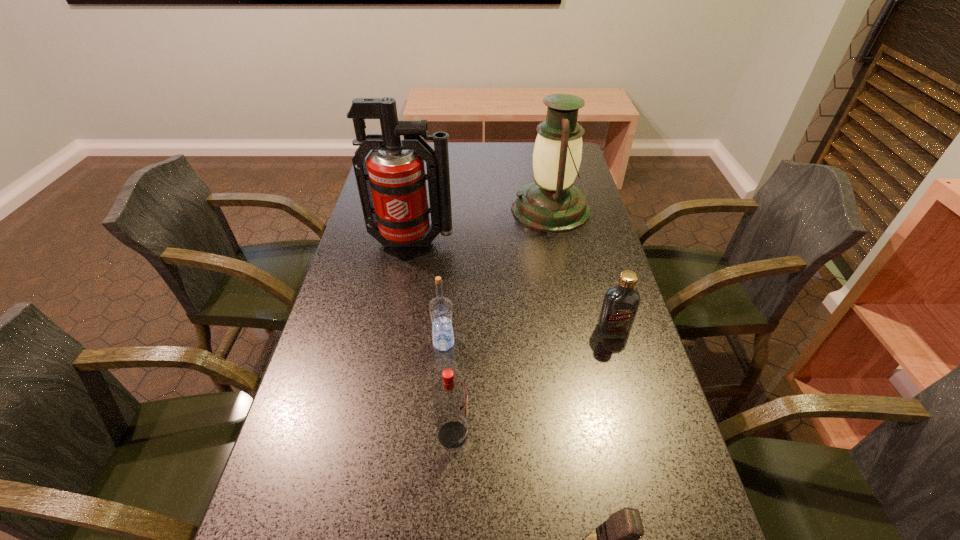
Locate an element on the screen. This screenshot has height=540, width=960. empty space that is in between the shortest vodka and the second tallest object is located at coordinates (582, 269).

At what (x,y) coordinates should I click in order to perform the action: click on empty space that is in between the nearest vodka and the rightmost vodka. Please return your answer as a coordinate pair (x, y). This screenshot has width=960, height=540. Looking at the image, I should click on 533,382.

At what (x,y) coordinates should I click in order to perform the action: click on vacant area between the shortest vodka and the fire extinguisher. Please return your answer as a coordinate pair (x, y). Looking at the image, I should click on (513, 286).

The image size is (960, 540). Identify the location of object identified as the fourth closest to the nearest object. (391, 182).

You are a GUI agent. You are given a task and a screenshot of the screen. Output one action in this format:
    pyautogui.click(x=<x>, y=<y>)
    Task: Click on the object that can be found as the fifth closest to the fifth shortest object
    
    Given the screenshot: What is the action you would take?
    pyautogui.click(x=617, y=539)

You are a GUI agent. You are given a task and a screenshot of the screen. Output one action in this format:
    pyautogui.click(x=<x>, y=<y>)
    Task: Click on the second closest vodka to the second tallest object
    
    Given the screenshot: What is the action you would take?
    pyautogui.click(x=440, y=308)

Locate which vodka ranks third in proximity to the lantern. Please provide its 2D coordinates. Your answer should be formatted as a tuple, i.e. [(x, y)], where the tuple contains the x and y coordinates of a point satisfying the conditions above.

[(450, 395)]

You are a GUI agent. You are given a task and a screenshot of the screen. Output one action in this format:
    pyautogui.click(x=<x>, y=<y>)
    Task: Click on the free space in the image that satisfies the following two spatial constraints: 1. on the front-facing side of the shortest vodka; 2. on the front label of the nearest vodka
    
    Given the screenshot: What is the action you would take?
    pyautogui.click(x=644, y=435)

You are a GUI agent. You are given a task and a screenshot of the screen. Output one action in this format:
    pyautogui.click(x=<x>, y=<y>)
    Task: Click on the vacant point that satisfies the following two spatial constraints: 1. on the front-facing side of the rightmost vodka; 2. on the front label of the nearest vodka
    
    Given the screenshot: What is the action you would take?
    pyautogui.click(x=644, y=435)

Locate an element on the screen. The height and width of the screenshot is (540, 960). free space that satisfies the following two spatial constraints: 1. on the front-facing side of the rightmost vodka; 2. on the front label of the fifth farthest object is located at coordinates (644, 435).